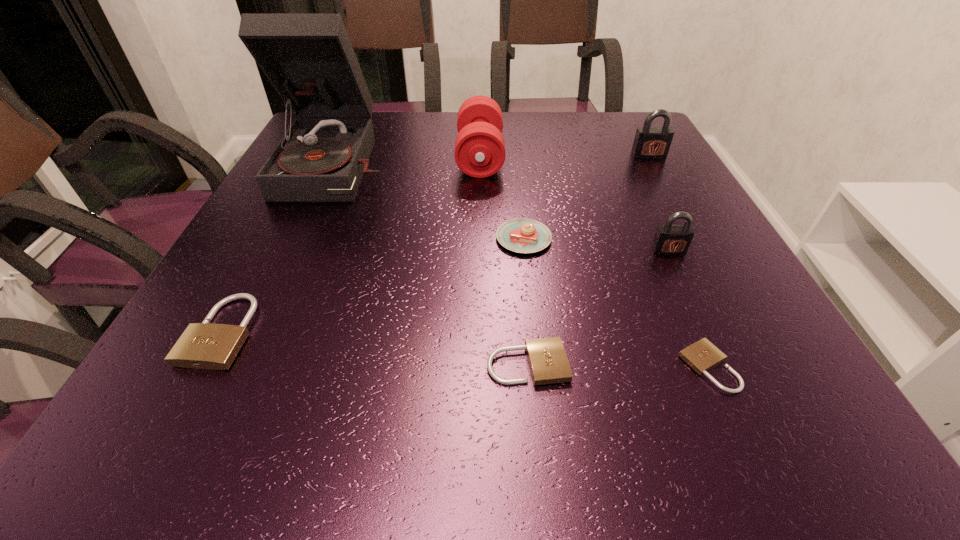
Locate an element on the screen. the seventh tallest object is located at coordinates (548, 362).

Where is `the rightmost beige padlock`? The width and height of the screenshot is (960, 540). the rightmost beige padlock is located at coordinates (702, 356).

At what (x,y) coordinates should I click in order to perform the action: click on the shortest padlock. Please return your answer as a coordinate pair (x, y). Image resolution: width=960 pixels, height=540 pixels. Looking at the image, I should click on (702, 356).

Find the location of a particular element. Image resolution: width=960 pixels, height=540 pixels. vacant space positioned on the front-facing side of the tallest object is located at coordinates (284, 285).

I want to click on free space located on the front of the tallest padlock near the keyhole, so click(710, 266).

The height and width of the screenshot is (540, 960). I want to click on free location located on the back of the dumbbell, so click(x=480, y=122).

Identify the location of blank space located 0.170m on the front of the nearer gray padlock near the keyhole. The width and height of the screenshot is (960, 540). (704, 323).

You are a GUI agent. You are given a task and a screenshot of the screen. Output one action in this format:
    pyautogui.click(x=<x>, y=<y>)
    Task: Click on the free space located on the left of the fourth shortest object
    This screenshot has width=960, height=540.
    Given the screenshot: What is the action you would take?
    pyautogui.click(x=392, y=239)

You are a GUI agent. You are given a task and a screenshot of the screen. Output one action in this format:
    pyautogui.click(x=<x>, y=<y>)
    Task: Click on the free space located 0.250m on the back of the leftmost beige padlock
    The image size is (960, 540).
    Given the screenshot: What is the action you would take?
    pyautogui.click(x=285, y=213)

At what (x,y) coordinates should I click in order to perform the action: click on free space located on the right of the second shortest object. Please return your answer as a coordinate pair (x, y). The height and width of the screenshot is (540, 960). Looking at the image, I should click on (640, 364).